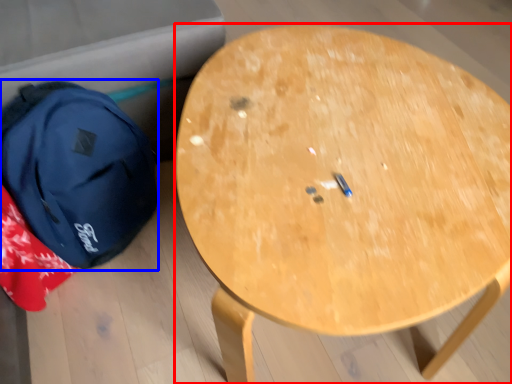
Question: Among these objects, which one is farthest to the camera, table (highlighted by a red box) or backpack (highlighted by a blue box)?

Choices:
 (A) table
 (B) backpack

Answer: (B)